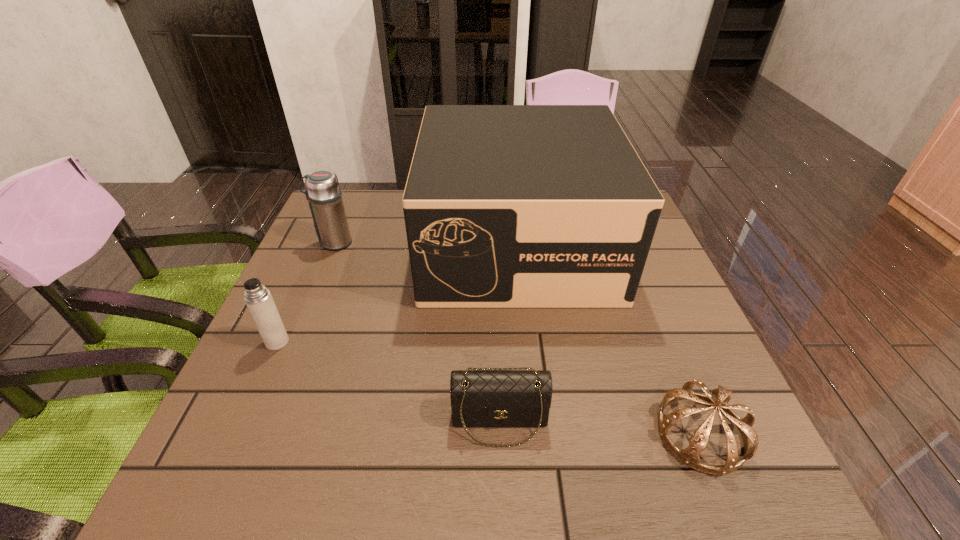
This screenshot has height=540, width=960. Identify the location of the fourth closest object relative to the tiara. (323, 193).

This screenshot has height=540, width=960. I want to click on object that is the fourth closest one to the shorter thermos bottle, so click(720, 397).

Find the location of `vacant space that satisfies the following two spatial constraints: 1. on the front-facing side of the tallest object; 2. on the right side of the tiara`. vacant space that satisfies the following two spatial constraints: 1. on the front-facing side of the tallest object; 2. on the right side of the tiara is located at coordinates (538, 434).

You are a GUI agent. You are given a task and a screenshot of the screen. Output one action in this format:
    pyautogui.click(x=<x>, y=<y>)
    Task: Click on the free spot that satisfies the following two spatial constraints: 1. with a handle on the side of the fourth shortest object; 2. on the back side of the tiara
    
    Given the screenshot: What is the action you would take?
    [x=254, y=434]